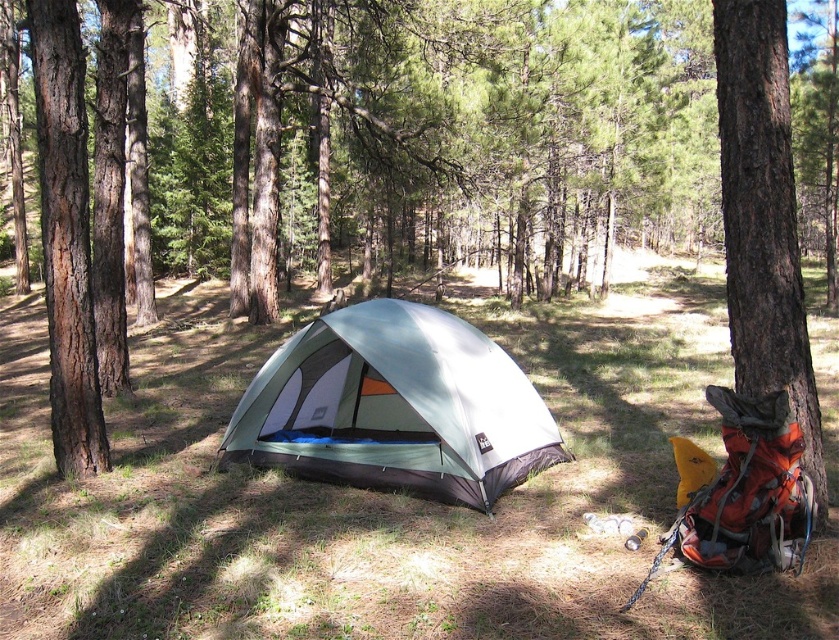
You are a camper setting up your gear. You have a green fabric tent at center and a brown rough bark tree at left. Which object is directly above the other?

The brown rough bark tree at left is directly above the green fabric tent at center because the tent is positioned under the tree.